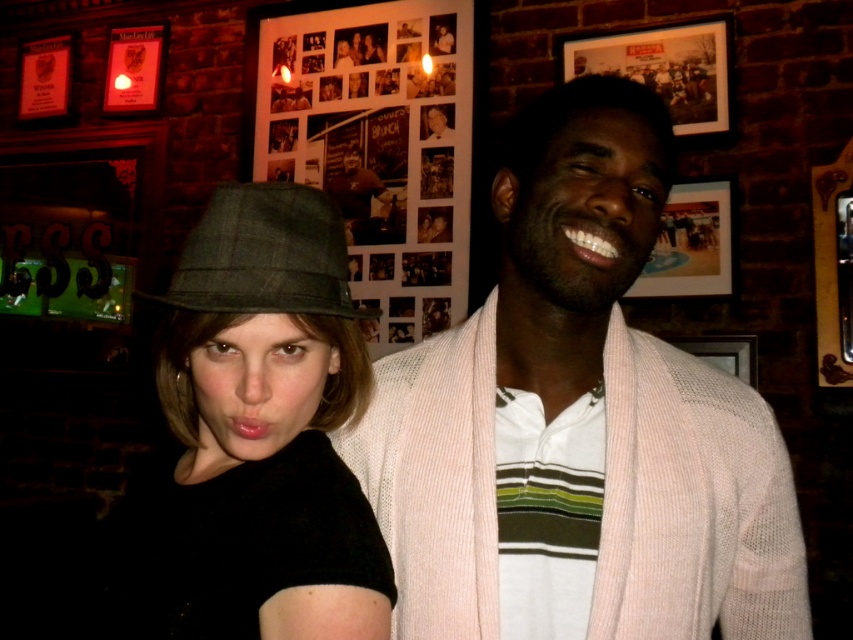
You are trying to decide whether to hang a coat hanger between the pink knit cardigan at center and the plaid fabric hat at center. Based on their widths, will there be enough space for the hanger?

The pink knit cardigan at center might be wider than plaid fabric hat at center, so there may be sufficient space for the hanger if the cardigan is indeed wider. However, since the exact width difference isn